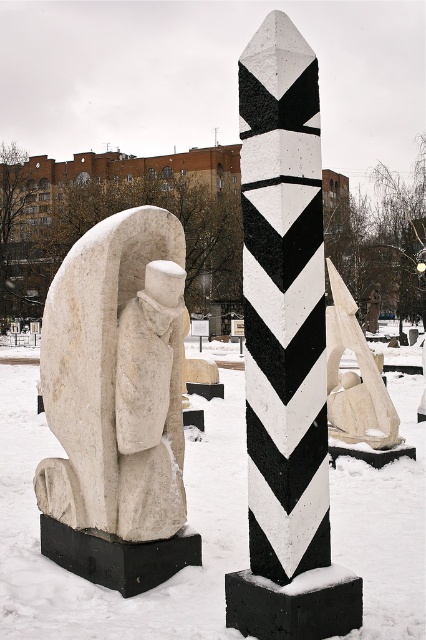
Does point (264, 403) lie in front of point (46, 484)?

Yes, it is in front of point (46, 484).

Is point (287, 276) more distant than point (85, 500)?

That is False.

Is point (259, 308) closer to camera compared to point (143, 477)?

Yes, point (259, 308) is closer to viewer.

I want to click on black and white painted concrete pillar at center, so click(284, 353).

Does white stone statue at left have a lesser width compared to white stone sculpture at center?

In fact, white stone statue at left might be wider than white stone sculpture at center.

Between point (77, 476) and point (340, 301), which one is positioned behind?

Point (340, 301)

The image size is (426, 640). Identify the location of white stone statue at left. (117, 404).

Where is `white stone statue at left`? The width and height of the screenshot is (426, 640). white stone statue at left is located at coordinates (117, 404).

Does black and white painted concrete pillar at center appear on the right side of white stone sculpture at center?

Incorrect, black and white painted concrete pillar at center is not on the right side of white stone sculpture at center.

Is point (252, 67) less distant than point (382, 355)?

Yes, it is.

Image resolution: width=426 pixels, height=640 pixels. I want to click on black and white painted concrete pillar at center, so click(x=284, y=353).